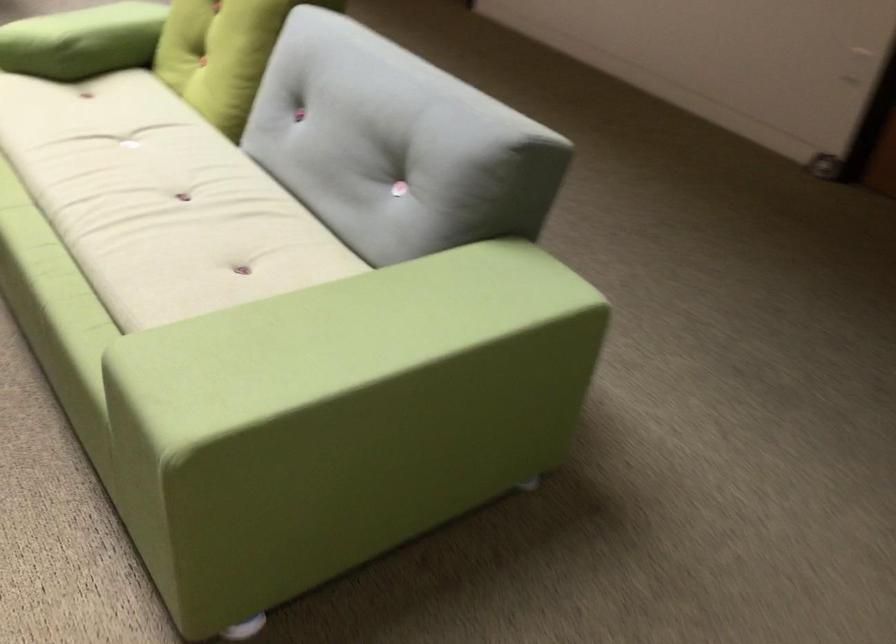
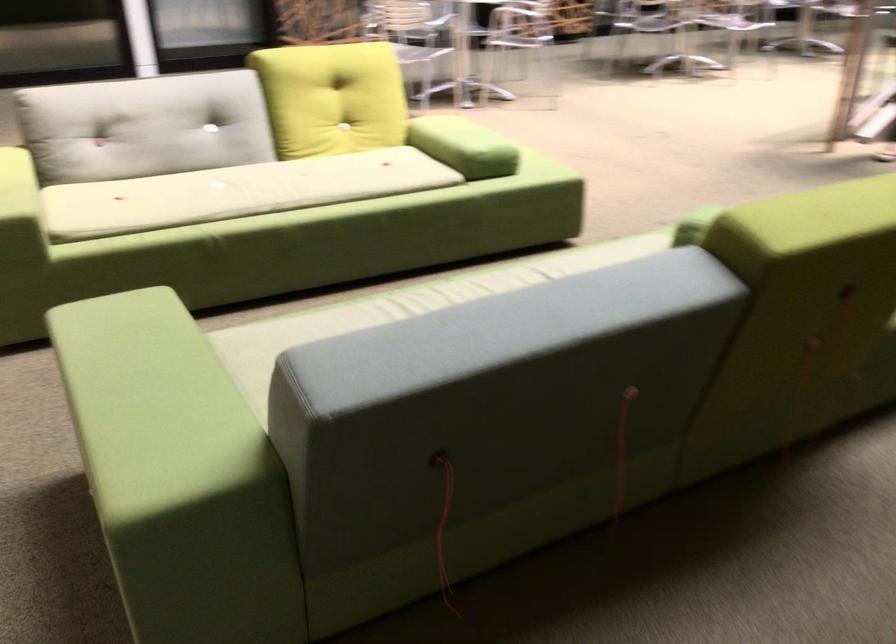
In the second image, find the point that corresponds to point 134,221 in the first image.

(401, 308)